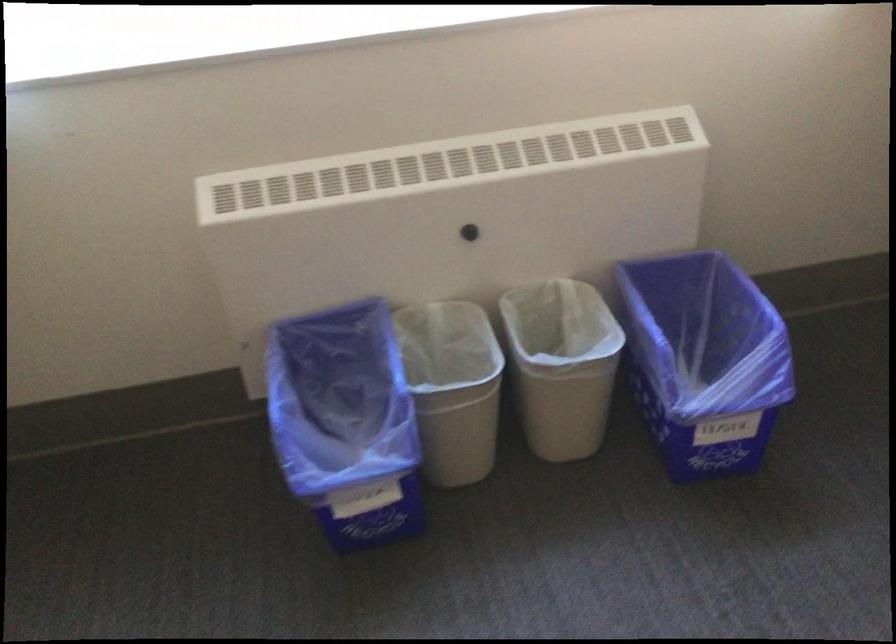
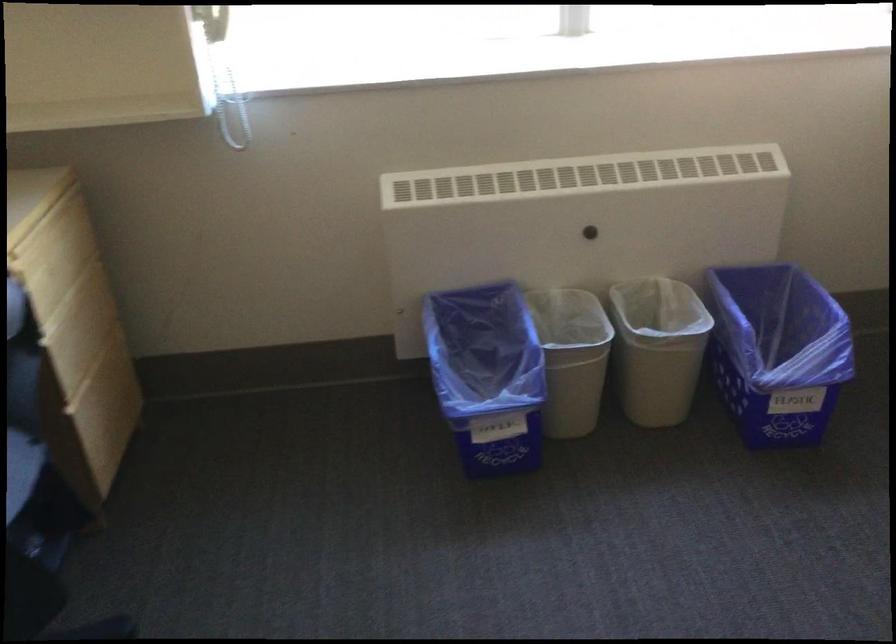
In the second image, find the point that corresponds to pixel 558 375 in the first image.

(657, 348)